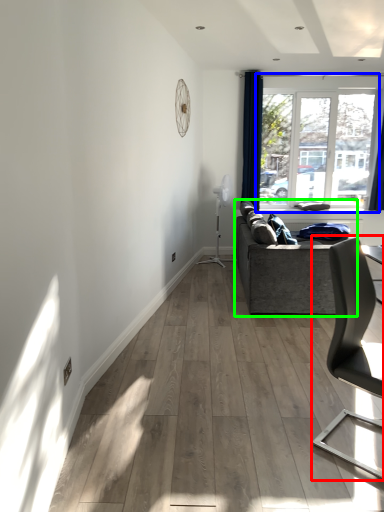
Question: Considering the real-world distances, which object is closest to chair (highlighted by a red box)? window (highlighted by a blue box) or studio couch (highlighted by a green box).

Choices:
 (A) window
 (B) studio couch

Answer: (B)